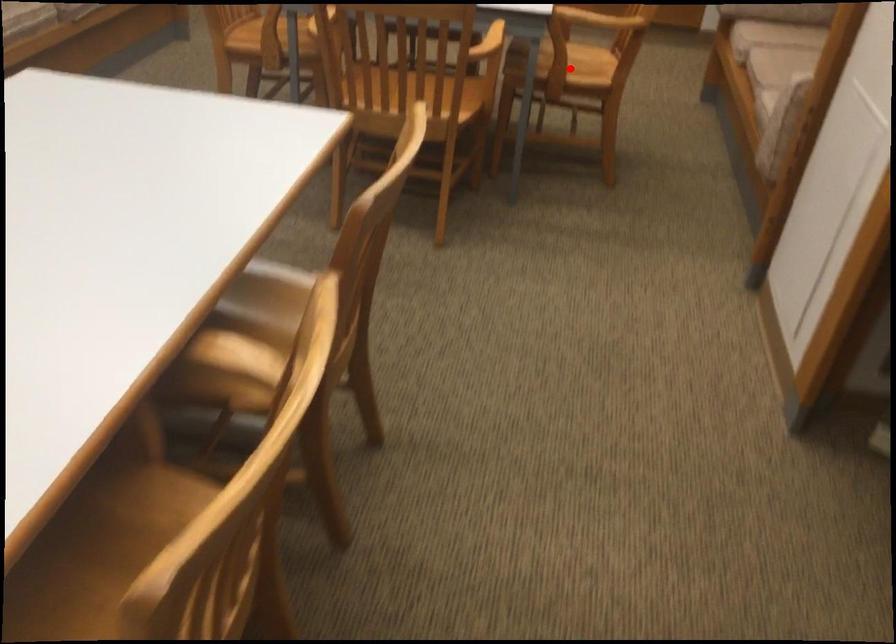
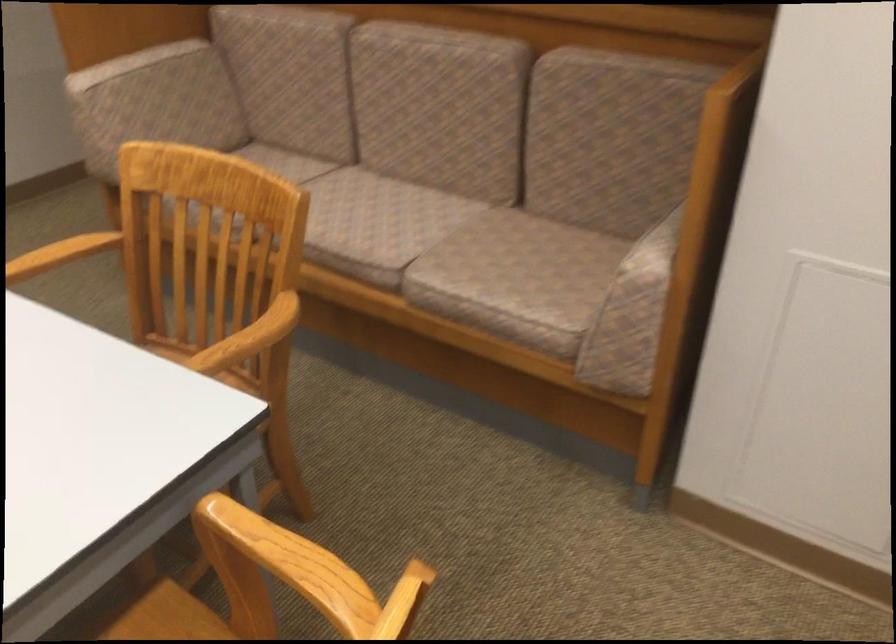
Question: I am providing you with two images of the same scene from different viewpoints. A red point is marked on the first image. Can you still see the location of the red point in image 2?

Choices:
 (A) Yes
 (B) No

Answer: (B)